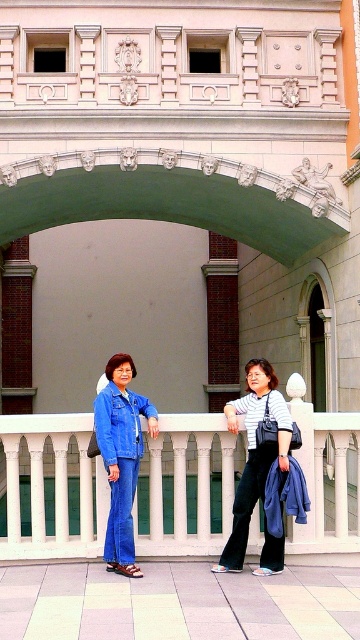
From the picture: You are a photographer wanting to capture both the white marble balustrade at center and the denim jacket at center in a single frame. Given their sizes, which object should you focus on to ensure both fit well in the photo?

The white marble balustrade at center is larger than the denim jacket at center, so focusing on the balustrade while adjusting the camera angle to include the jacket will ensure both fit well in the photo.

You are a photographer standing on the paved area in front of the classical building. You want to take a photo of both the green stone arch at center and the striped cotton shirt at center in the same frame. Given that your camera has a maximum focal length that allows capturing objects up to 8 meters apart in the frame, will you be able to include both in the photo?

The green stone arch at center and striped cotton shirt at center are 7.75 meters apart, which is within the camera maximum focal length of 8 meters. Therefore, both can be captured in the same frame.

You are a visitor standing in front of the classical building. You see the white marble balustrade at center and the green stone arch at center. Which object is positioned higher relative to the other?

The green stone arch at center is positioned higher than the white marble balustrade at center because the white marble balustrade at center is located below it.